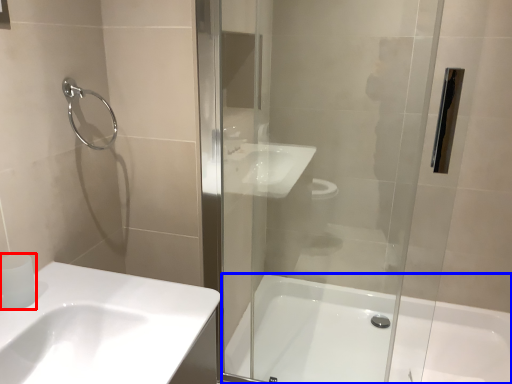
Question: Among these objects, which one is farthest to the camera, toilet paper (highlighted by a red box) or bathtub (highlighted by a blue box)?

Choices:
 (A) toilet paper
 (B) bathtub

Answer: (B)